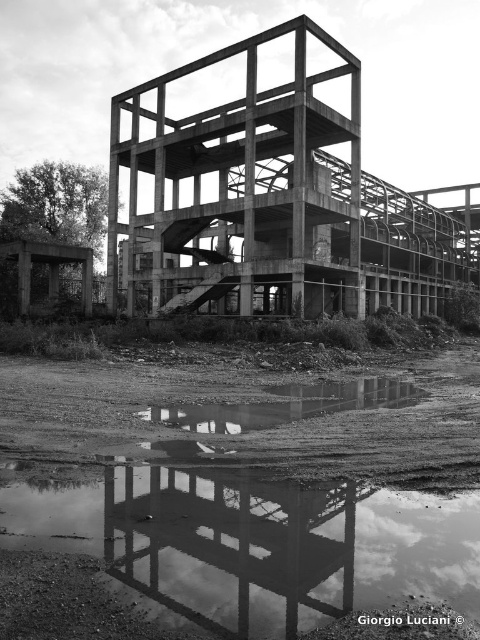
Does transparent water at lower center have a greater height compared to reflective glass structure at center?

Yes, transparent water at lower center is taller than reflective glass structure at center.

Between point (225, 476) and point (160, 532), which one is positioned behind?

Positioned behind is point (225, 476).

The width and height of the screenshot is (480, 640). I want to click on transparent water at lower center, so click(x=250, y=488).

Which of these two, transparent water at lower center or concrete/cement structure at center, stands taller?

Standing taller between the two is concrete/cement structure at center.

Which is more to the left, transparent water at lower center or concrete/cement structure at center?

From the viewer's perspective, transparent water at lower center appears more on the left side.

Who is more distant from viewer, [156,524] or [222,164]?

The point [222,164] is more distant.

Locate an element on the screen. This screenshot has width=480, height=640. transparent water at lower center is located at coordinates (250, 488).

Can you confirm if concrete/cement structure at center is thinner than reflective glass structure at center?

Incorrect, concrete/cement structure at center's width is not less than reflective glass structure at center's.

Between point (328, 164) and point (348, 528), which one is positioned in front?

Point (348, 528) is more forward.

At what (x,y) coordinates should I click in order to perform the action: click on concrete/cement structure at center. Please return your answer as a coordinate pair (x, y). Image resolution: width=480 pixels, height=640 pixels. Looking at the image, I should click on (276, 202).